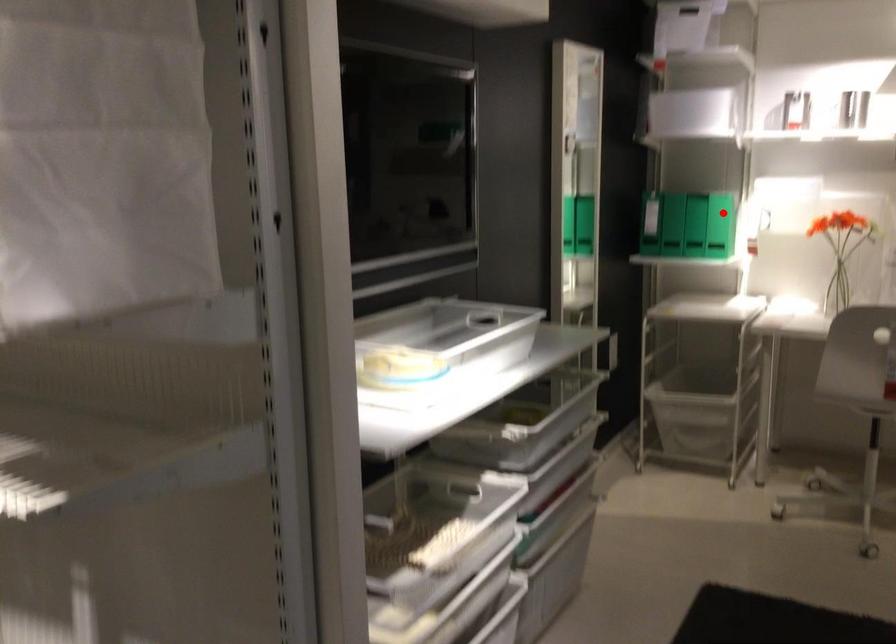
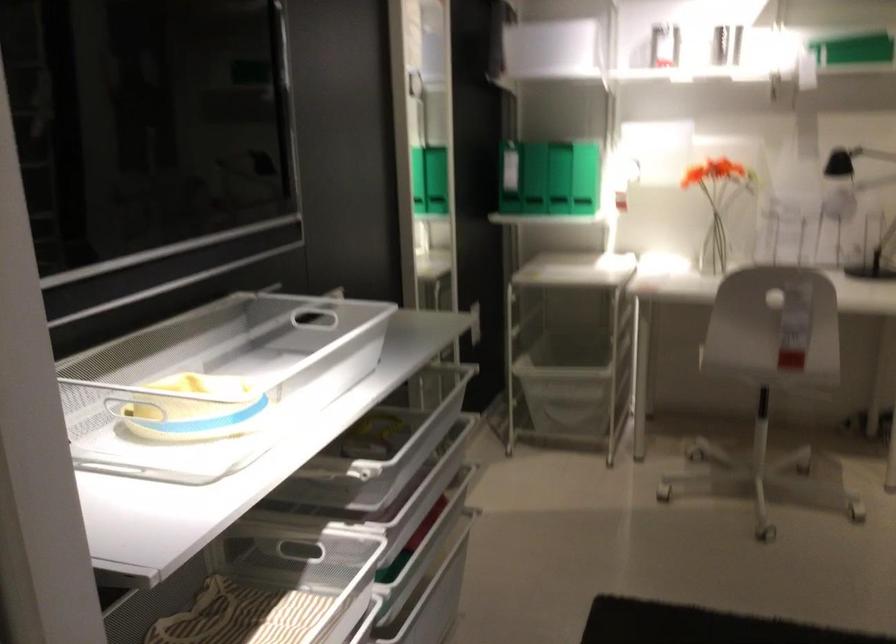
In the second image, find the point that corresponds to the highlighted location in the first image.

(558, 178)